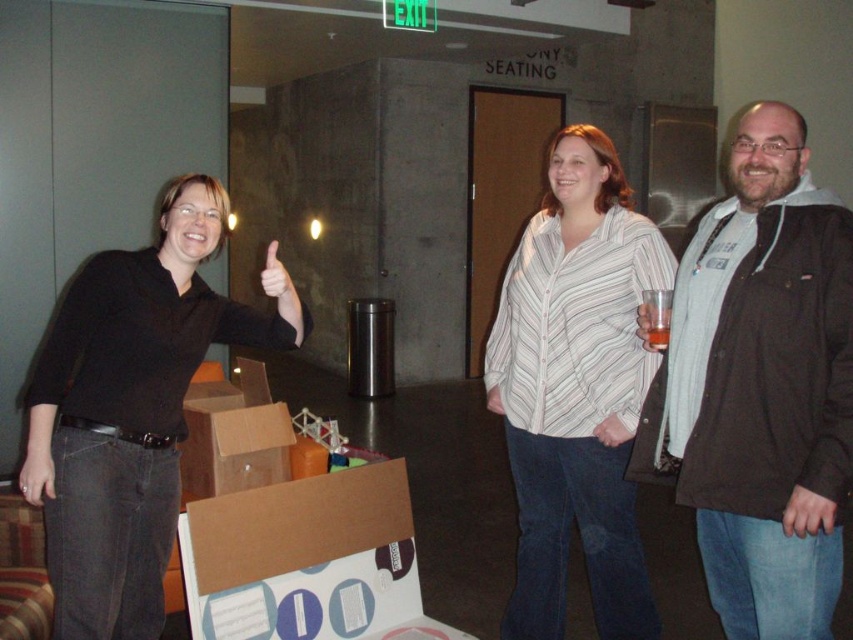
You are organizing a clothing donation drive and need to know if the dark brown jacket at right can fit into a donation box that is the same width as the black matte shirt at left. Can it fit?

The dark brown jacket at right has a width less than the black matte shirt at left, so it can fit into the donation box with the same width as the black matte shirt at left.

You are organizing a space and need to know the sizes of the people in the image. Which person takes up more space in the image, the black matte shirt at left or the white striped shirt at center?

The white striped shirt at center occupies more space in the image than the black matte shirt at left according to the description.

You are standing in a room where two people are positioned such that the black matte shirt at left and the white striped shirt at center are visible. If you want to hand a document to both individuals without moving from your current spot, which person should you hand the document to first to ensure it reaches the other person through passing?

You should hand the document to the white striped shirt at center first because the black matte shirt at left is 37.24 inches away from the white striped shirt at center, so passing it through the closer individual first would be more efficient.